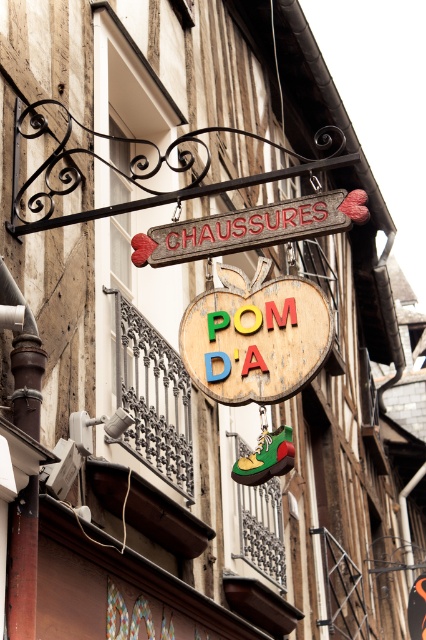
Which of these two, wooden sign at center or wooden signboard at center, stands shorter?

With less height is wooden sign at center.

Is wooden sign at center to the left of wooden signboard at center from the viewer's perspective?

Yes, wooden sign at center is to the left of wooden signboard at center.

Identify the location of wooden sign at center. The width and height of the screenshot is (426, 640). [256, 336].